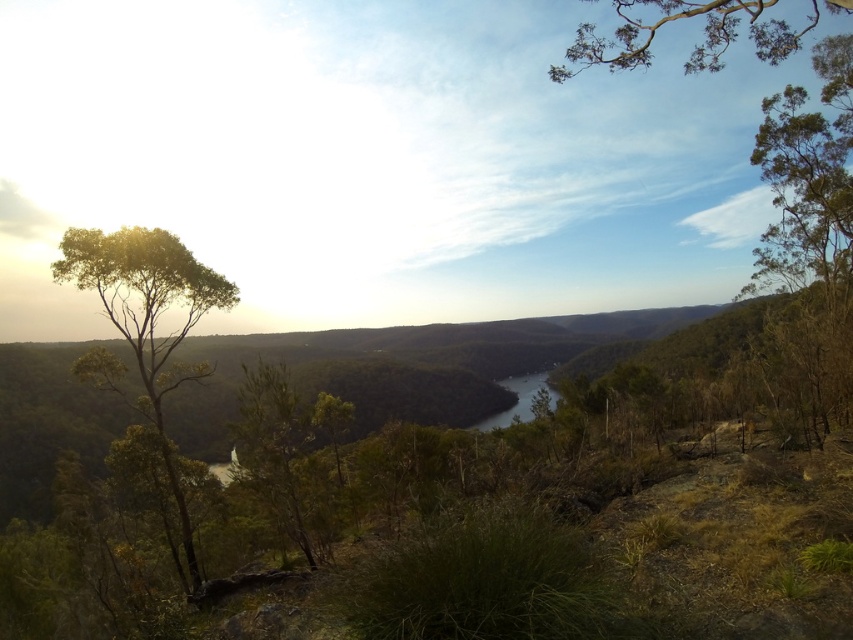
Is point (128, 323) closer to viewer compared to point (531, 397)?

Yes, point (128, 323) is in front of point (531, 397).

This screenshot has width=853, height=640. I want to click on green leafy tree at left, so click(x=148, y=320).

Can you confirm if green leafy tree at upper right is wider than shiny dark water at center?

Yes.

Can you confirm if green leafy tree at upper right is taller than shiny dark water at center?

Yes, green leafy tree at upper right is taller than shiny dark water at center.

Is point (573, 51) closer to camera compared to point (505, 417)?

Yes, it is.

This screenshot has height=640, width=853. Find the location of `green leafy tree at upper right`. green leafy tree at upper right is located at coordinates (695, 44).

Image resolution: width=853 pixels, height=640 pixels. Describe the element at coordinates (148, 320) in the screenshot. I see `green leafy tree at left` at that location.

Does green leafy tree at left appear under green leafy tree at upper right?

Yes.

Does point (178, 486) come farther from viewer compared to point (635, 54)?

Yes.

At what (x,y) coordinates should I click in order to perform the action: click on green leafy tree at left. Please return your answer as a coordinate pair (x, y). Looking at the image, I should click on (148, 320).